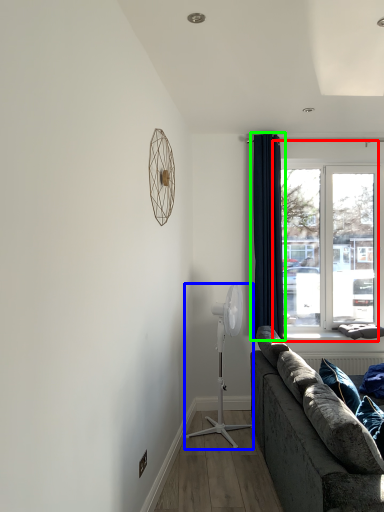
Question: Which object is the farthest from window (highlighted by a red box)? Choose among these: mechanical fan (highlighted by a blue box) or curtain (highlighted by a green box).

Choices:
 (A) mechanical fan
 (B) curtain

Answer: (A)